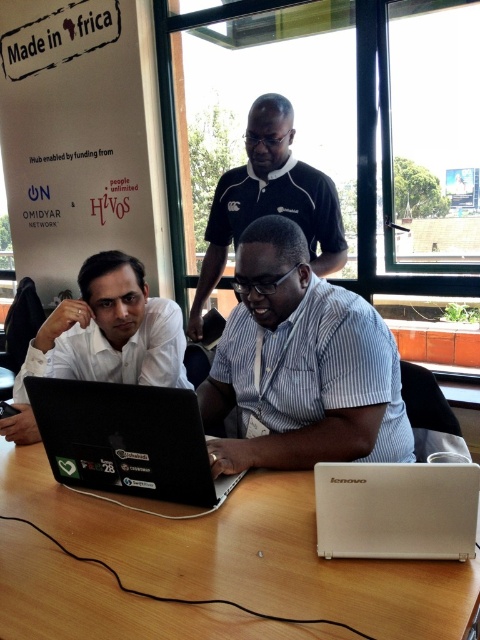
Where is `wooden table at center`? The height and width of the screenshot is (640, 480). wooden table at center is located at coordinates (247, 554).

Which is more to the left, wooden table at center or black polo shirt at center?

From the viewer's perspective, wooden table at center appears more on the left side.

The image size is (480, 640). What do you see at coordinates (247, 554) in the screenshot? I see `wooden table at center` at bounding box center [247, 554].

Where is `wooden table at center`? Image resolution: width=480 pixels, height=640 pixels. wooden table at center is located at coordinates pyautogui.click(x=247, y=554).

Which of these two, white striped shirt at center or white matte shirt at left, stands taller?

white striped shirt at center

Does point (337, 364) lie behind point (134, 356)?

No, it is in front of (134, 356).

This screenshot has height=640, width=480. What are the coordinates of `white striped shirt at center` in the screenshot? It's located at (301, 365).

Is point (15, 445) farther from viewer compared to point (121, 288)?

No, it is not.

Between wooden table at center and white matte shirt at left, which one appears on the left side from the viewer's perspective?

Positioned to the left is white matte shirt at left.

The height and width of the screenshot is (640, 480). I want to click on wooden table at center, so click(x=247, y=554).

You are a GUI agent. You are given a task and a screenshot of the screen. Output one action in this format:
    pyautogui.click(x=<x>, y=<y>)
    Task: Click on the wooden table at center
    This screenshot has width=480, height=640.
    Given the screenshot: What is the action you would take?
    pyautogui.click(x=247, y=554)